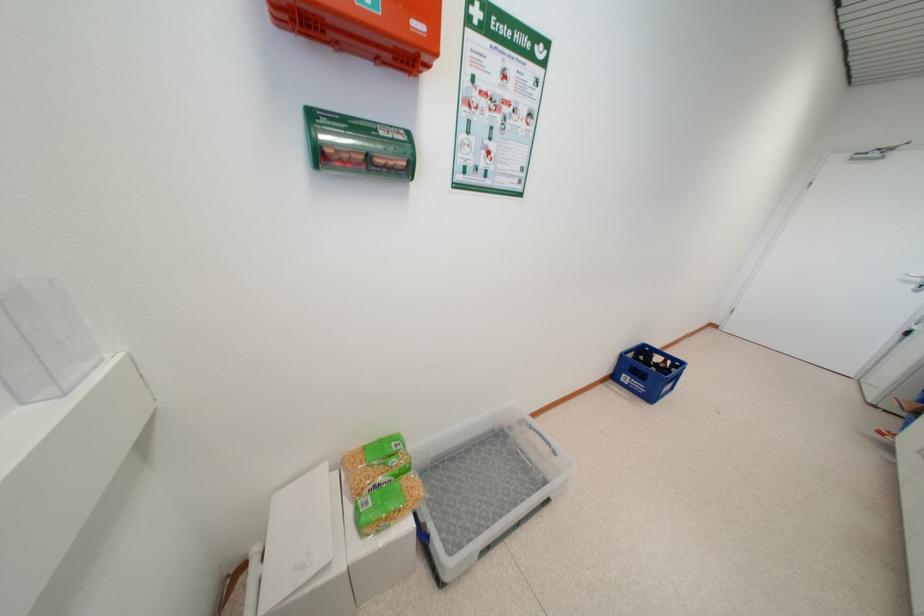
What are the coordinates of `silver door handle` in the screenshot? It's located at (915, 281).